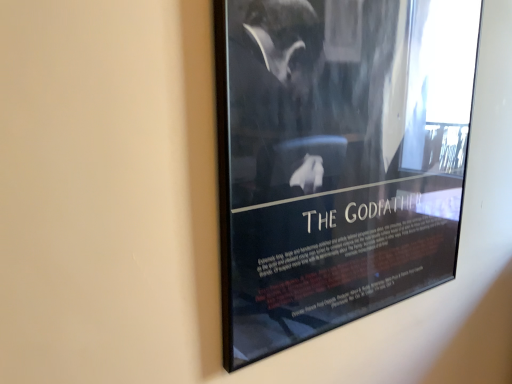
Locate an element on the screen. Image resolution: width=512 pixels, height=384 pixels. black glass picture frame at upper right is located at coordinates (337, 159).

In order to face black glass picture frame at upper right, should I rotate leftwards or rightwards?

A 15.056 degree turn to the right will do.

What do you see at coordinates (337, 159) in the screenshot? The image size is (512, 384). I see `black glass picture frame at upper right` at bounding box center [337, 159].

What is the approximate width of black glass picture frame at upper right?

black glass picture frame at upper right is 3.35 inches in width.

Identify the location of black glass picture frame at upper right. Image resolution: width=512 pixels, height=384 pixels. (337, 159).